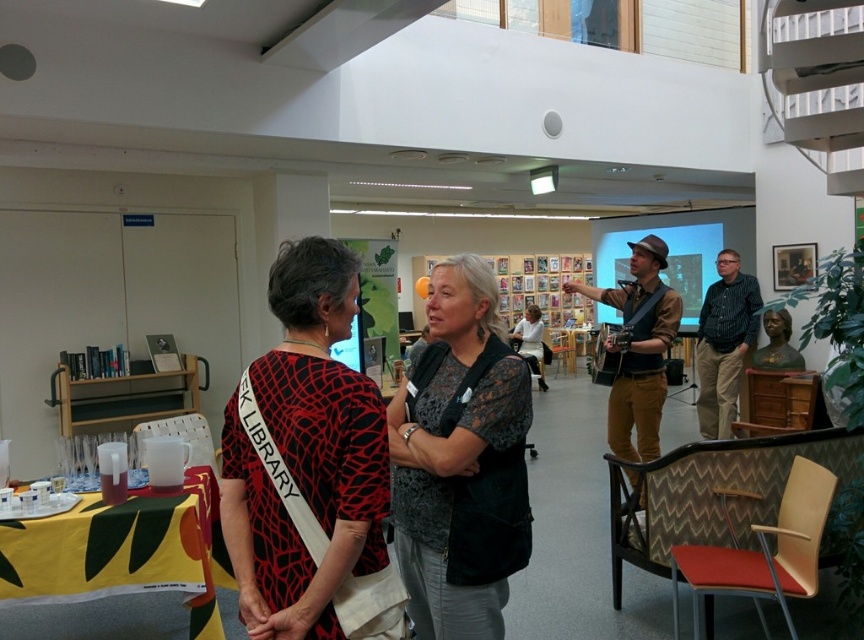
Is red and black printed blouse at center above dark gray lace blouse at center?

Correct, red and black printed blouse at center is located above dark gray lace blouse at center.

Is red and black printed blouse at center wider than dark gray lace blouse at center?

In fact, red and black printed blouse at center might be narrower than dark gray lace blouse at center.

Describe the element at coordinates (305, 454) in the screenshot. This screenshot has width=864, height=640. I see `red and black printed blouse at center` at that location.

Where is `red and black printed blouse at center`? red and black printed blouse at center is located at coordinates (305, 454).